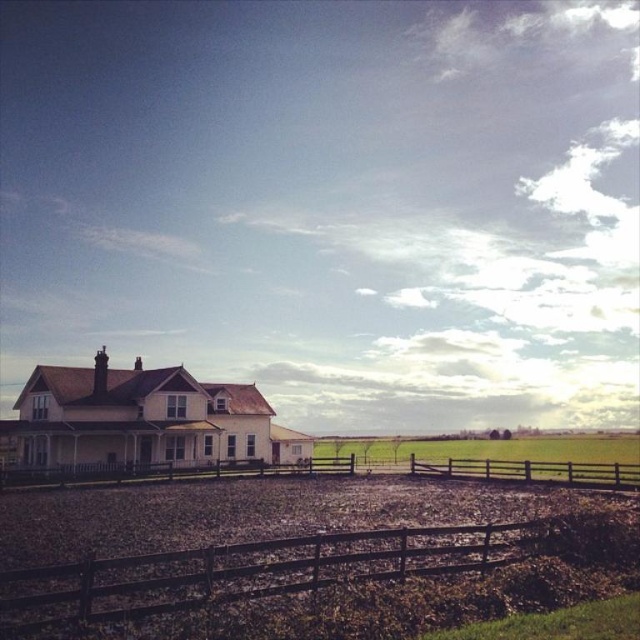
Question: Which object is positioned closest to the brown wooden fence at lower center?

Choices:
 (A) green grass at center
 (B) brown wooden fence at center

Answer: (B)

Question: Which is farther from the brown wooden fence at lower center?

Choices:
 (A) brown wooden fence at center
 (B) green grass at center

Answer: (B)

Question: In this image, where is brown wooden fence at lower center located relative to green grass at center?

Choices:
 (A) left
 (B) right

Answer: (A)

Question: Which of the following is the farthest from the observer?

Choices:
 (A) brown wooden fence at center
 (B) green grass at center
 (C) brown wooden fence at lower center

Answer: (B)

Question: Is brown wooden fence at lower center wider than brown wooden fence at center?

Choices:
 (A) yes
 (B) no

Answer: (B)

Question: Is brown wooden fence at lower center further to the viewer compared to brown wooden fence at center?

Choices:
 (A) yes
 (B) no

Answer: (B)